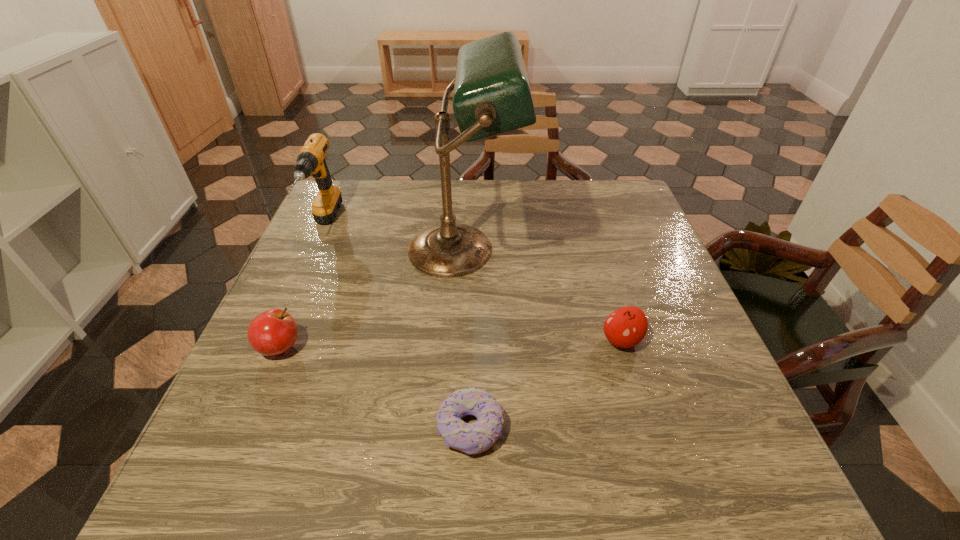
You are a GUI agent. You are given a task and a screenshot of the screen. Output one action in this format:
    pyautogui.click(x=<x>, y=<y>)
    Task: Click on the vacant space located 0.180m on the right of the shortest object
    This screenshot has height=540, width=960.
    Given the screenshot: What is the action you would take?
    pyautogui.click(x=607, y=428)

You are a GUI agent. You are given a task and a screenshot of the screen. Output one action in this format:
    pyautogui.click(x=<x>, y=<y>)
    Task: Click on the table lamp positioned at the far edge
    
    Given the screenshot: What is the action you would take?
    pyautogui.click(x=492, y=95)

The image size is (960, 540). Find the location of `drill that is at the far edge`. drill that is at the far edge is located at coordinates (311, 160).

This screenshot has width=960, height=540. I want to click on object present at the near edge, so click(x=474, y=438).

You are a GUI agent. You are given a task and a screenshot of the screen. Output one action in this format:
    pyautogui.click(x=<x>, y=<y>)
    Task: Click on the drill located in the left edge section of the desktop
    
    Given the screenshot: What is the action you would take?
    pyautogui.click(x=311, y=160)

What are the coordinates of `apple positioned at the left edge` in the screenshot? It's located at coord(273,332).

Locate an element on the screen. object situated at the right edge is located at coordinates (626, 327).

I want to click on object that is positioned at the far left corner, so click(311, 160).

You are a GUI agent. You are given a task and a screenshot of the screen. Output one action in this format:
    pyautogui.click(x=<x>, y=<y>)
    Task: Click on the vacant space at the far edge of the desktop
    This screenshot has height=540, width=960.
    Given the screenshot: What is the action you would take?
    pyautogui.click(x=551, y=181)

Find the location of a particular element. This screenshot has width=960, height=540. free location at the near edge of the desktop is located at coordinates (457, 485).